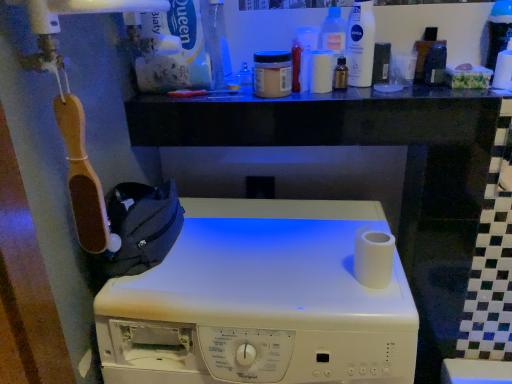
The height and width of the screenshot is (384, 512). Find the location of `free space behind white matte toilet paper at right, the second toilet paper positioned from the back`. free space behind white matte toilet paper at right, the second toilet paper positioned from the back is located at coordinates (325, 234).